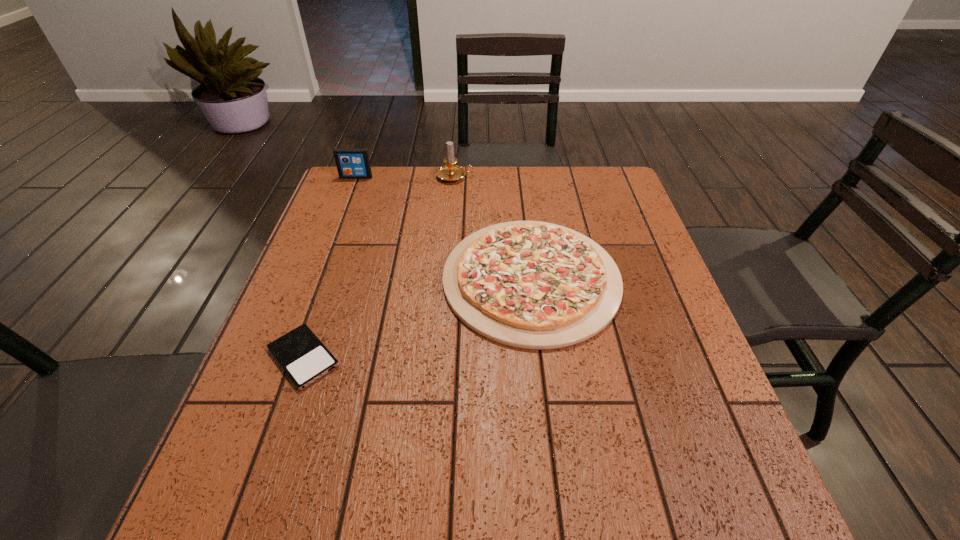
This screenshot has width=960, height=540. Find the location of `free space that satisfies the following two spatial constraints: 1. on the front screen of the pizza; 2. on the left side of the second tallest object`. free space that satisfies the following two spatial constraints: 1. on the front screen of the pizza; 2. on the left side of the second tallest object is located at coordinates point(318,279).

What are the coordinates of `vacant space that satisfies the following two spatial constraints: 1. on the front screen of the third tallest object; 2. on the right side of the second tallest object` in the screenshot? It's located at (318, 279).

Find the location of a particular element. The width and height of the screenshot is (960, 540). free space that satisfies the following two spatial constraints: 1. on the front screen of the farther iPod; 2. on the right side of the nearer iPod is located at coordinates (288, 357).